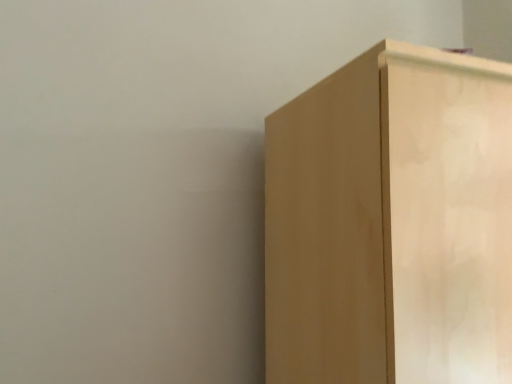
What do you see at coordinates (392, 223) in the screenshot? Image resolution: width=512 pixels, height=384 pixels. I see `light wood cupboard at right` at bounding box center [392, 223].

Identify the location of light wood cupboard at right. This screenshot has width=512, height=384. (x=392, y=223).

You are a GUI agent. You are given a task and a screenshot of the screen. Output one action in this format:
    pyautogui.click(x=<x>, y=<y>)
    Task: Click on the light wood cupboard at right
    Image resolution: width=512 pixels, height=384 pixels.
    Given the screenshot: What is the action you would take?
    pyautogui.click(x=392, y=223)